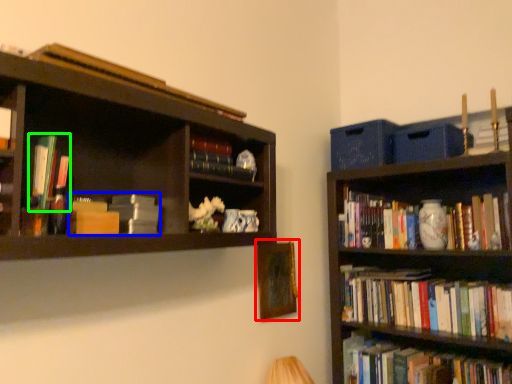
Question: Which object is positioned farthest from picture frame (highlighted by a red box)? Select from book (highlighted by a blue box) and book (highlighted by a green box).

Choices:
 (A) book
 (B) book

Answer: (B)